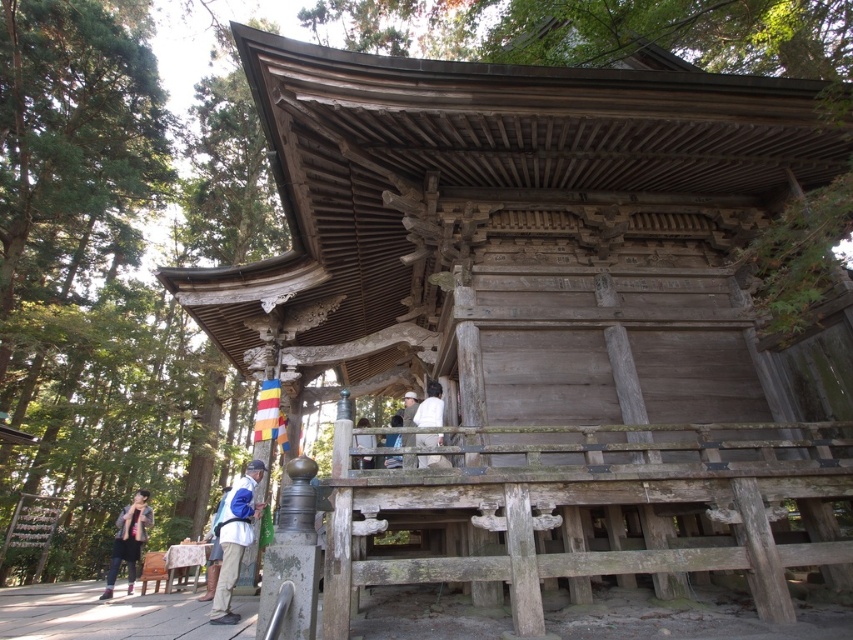
Is denim jacket at lower left wider than white fabric bag at center?

Yes.

Who is shorter, denim jacket at lower left or white fabric bag at center?

With less height is white fabric bag at center.

What do you see at coordinates (128, 540) in the screenshot? The image size is (853, 640). I see `denim jacket at lower left` at bounding box center [128, 540].

The height and width of the screenshot is (640, 853). I want to click on denim jacket at lower left, so click(x=128, y=540).

Describe the element at coordinates (128, 540) in the screenshot. I see `denim jacket at lower left` at that location.

Is denim jacket at lower left above white fabric at center?

Actually, denim jacket at lower left is below white fabric at center.

The width and height of the screenshot is (853, 640). Identify the location of denim jacket at lower left. (128, 540).

Locate an element on the screen. The height and width of the screenshot is (640, 853). denim jacket at lower left is located at coordinates (128, 540).

What do you see at coordinates (235, 538) in the screenshot?
I see `white fabric bag at lower center` at bounding box center [235, 538].

Which is above, white fabric bag at lower center or white fabric bag at center?

Positioned higher is white fabric bag at center.

Which is behind, point (222, 564) or point (360, 438)?

The point (360, 438) is behind.

Where is `white fabric bag at lower center`? The width and height of the screenshot is (853, 640). white fabric bag at lower center is located at coordinates (235, 538).